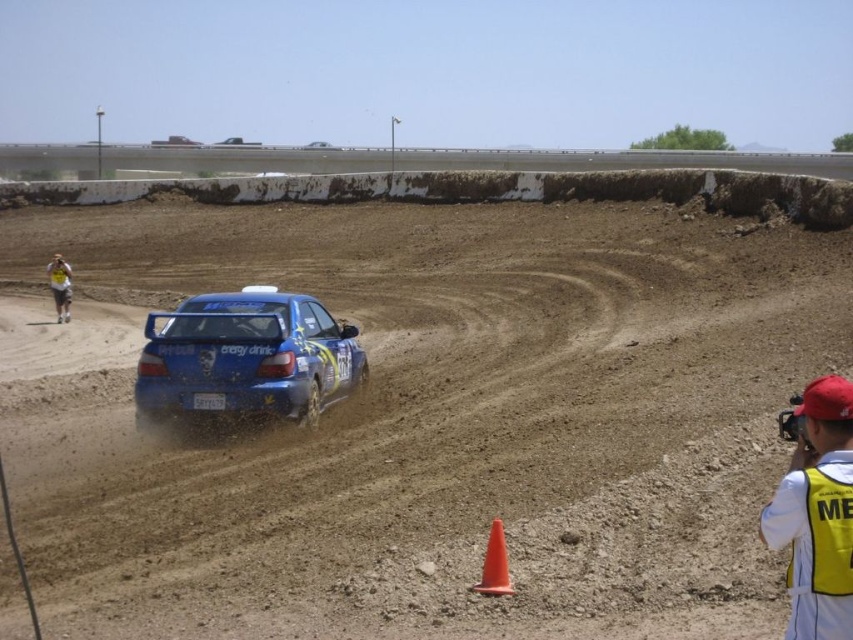
Can you confirm if blue glossy rally car at center is positioned below yellow reflective vest at lower right?

No, blue glossy rally car at center is not below yellow reflective vest at lower right.

Based on the photo, does blue glossy rally car at center have a lesser width compared to yellow reflective vest at lower right?

Correct, blue glossy rally car at center's width is less than yellow reflective vest at lower right's.

Between point (259, 301) and point (848, 438), which one is positioned behind?

The point (259, 301) is behind.

Identify the location of blue glossy rally car at center. The image size is (853, 640). (x=247, y=356).

Between point (47, 272) and point (59, 268), which one is positioned behind?

Positioned behind is point (47, 272).

Can you confirm if yellow shirt at left is smaller than yellow/yellowish fabric safety vest at left?

No.

You are a GUI agent. You are given a task and a screenshot of the screen. Output one action in this format:
    pyautogui.click(x=<x>, y=<y>)
    Task: Click on the yellow shirt at left
    This screenshot has height=640, width=853.
    Given the screenshot: What is the action you would take?
    pyautogui.click(x=61, y=285)

Between point (270, 316) and point (79, 147), which one is positioned behind?

Point (79, 147)

Is point (213, 369) farther from camera compared to point (590, 156)?

No, it is in front of (590, 156).

Who is more distant from viewer, (325, 332) or (538, 160)?

Point (538, 160)

Where is `blue glossy rally car at center`? The height and width of the screenshot is (640, 853). blue glossy rally car at center is located at coordinates (247, 356).